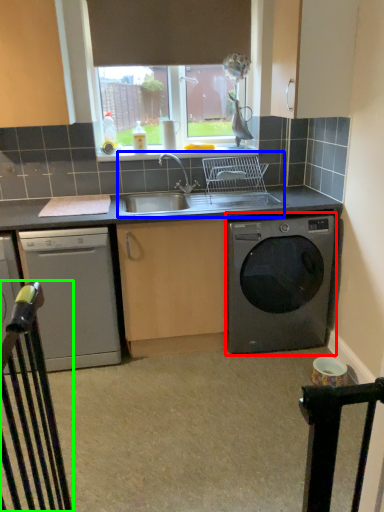
Question: Which is nearer to the washing machine (highlighted by a red box)? sink (highlighted by a blue box) or rail (highlighted by a green box).

Choices:
 (A) sink
 (B) rail

Answer: (A)